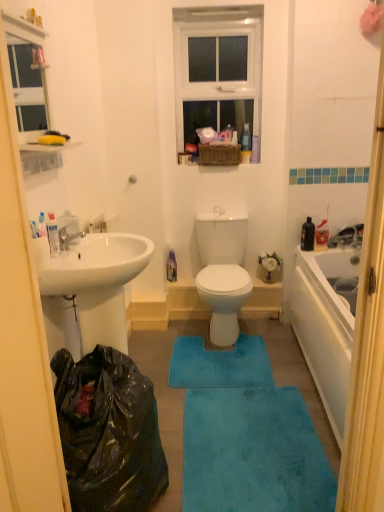
This screenshot has width=384, height=512. Find the location of `free location above blue plush bath mat at center, which ranks as the second bath mat in bottom-to-top order (from a real-world perspective)`. free location above blue plush bath mat at center, which ranks as the second bath mat in bottom-to-top order (from a real-world perspective) is located at coordinates (x=210, y=356).